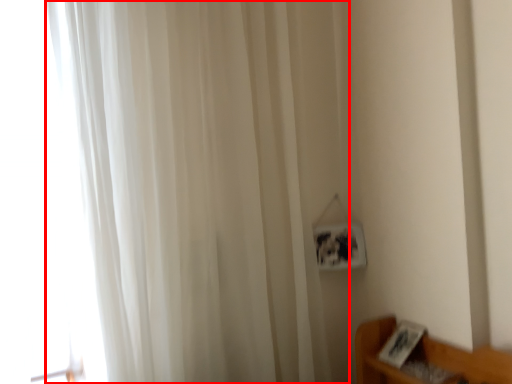
Question: Where is curtain (annotated by the red box) located in relation to glass door in the image?

Choices:
 (A) right
 (B) left

Answer: (A)